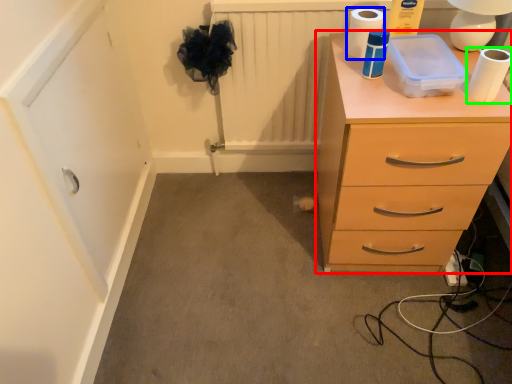
Question: Which object is the closest to the chest of drawers (highlighted by a red box)? Choose among these: toilet paper (highlighted by a blue box) or toilet paper (highlighted by a green box).

Choices:
 (A) toilet paper
 (B) toilet paper

Answer: (B)